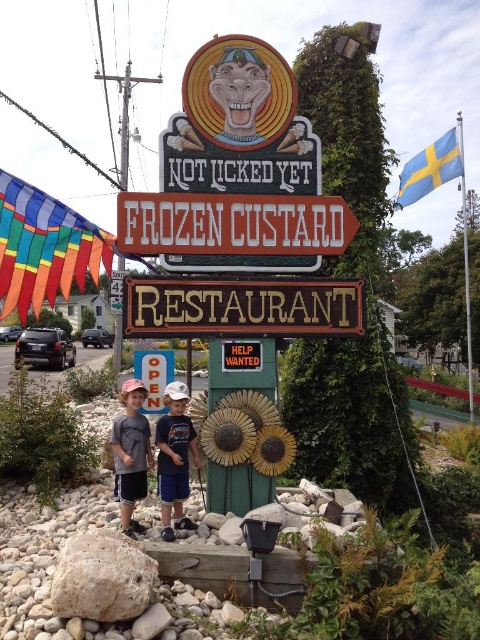
You are a customer looking for the entrance to the Frozen Custard Restaurant. You see the blue denim shorts at center and the gray cotton shirt at lower center. Which object should you follow the direction of the red arrow to find the entrance?

The red arrow on the sign points towards the entrance, so you should follow the direction of the red arrow, not the blue denim shorts at center or the gray cotton shirt at lower center.

You are a customer standing in front of the Frozen Custard Restaurant sign. You notice the brown wooden sign at center and the gray cotton shirt at lower center. Which object appears larger in the image?

The gray cotton shirt at lower center appears larger than the brown wooden sign at center because the brown wooden sign at center is smaller than gray cotton shirt at lower center.

You are a customer standing in front of the Frozen Custard Restaurant sign. You see the white painted wood signboard at center and the gray cotton shirt at lower center. Which object is positioned higher up?

The white painted wood signboard at center is located above the gray cotton shirt at lower center, so it is positioned higher up.